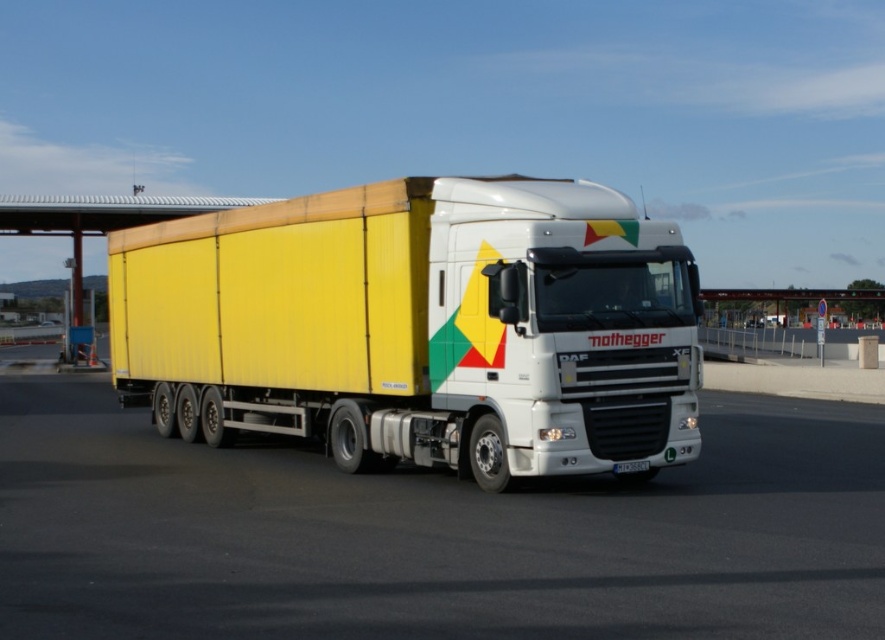
Measure the distance between white glossy highway at center and yellow matte trailer at center.

The distance of white glossy highway at center from yellow matte trailer at center is 7.11 feet.

Who is shorter, white glossy highway at center or yellow matte trailer at center?

white glossy highway at center

Measure the distance between white glossy highway at center and camera.

white glossy highway at center is 5.84 meters away from camera.

Identify the location of white glossy highway at center. (433, 534).